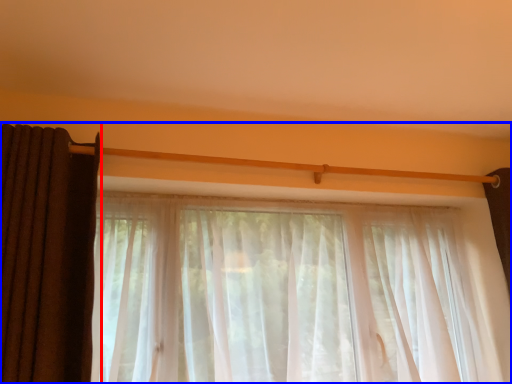
Question: Among these objects, which one is nearest to the camera, curtain (highlighted by a red box) or curtain (highlighted by a blue box)?

Choices:
 (A) curtain
 (B) curtain

Answer: (A)